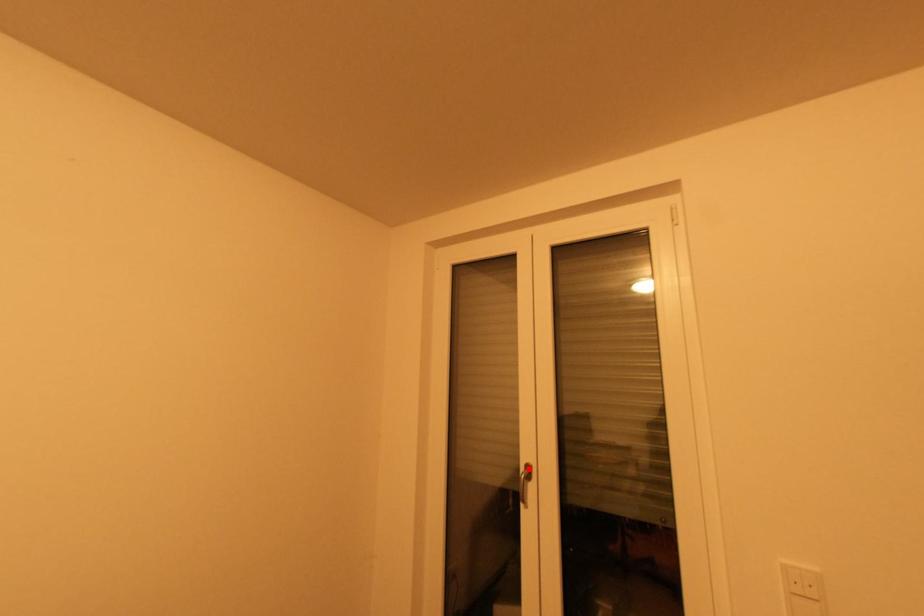
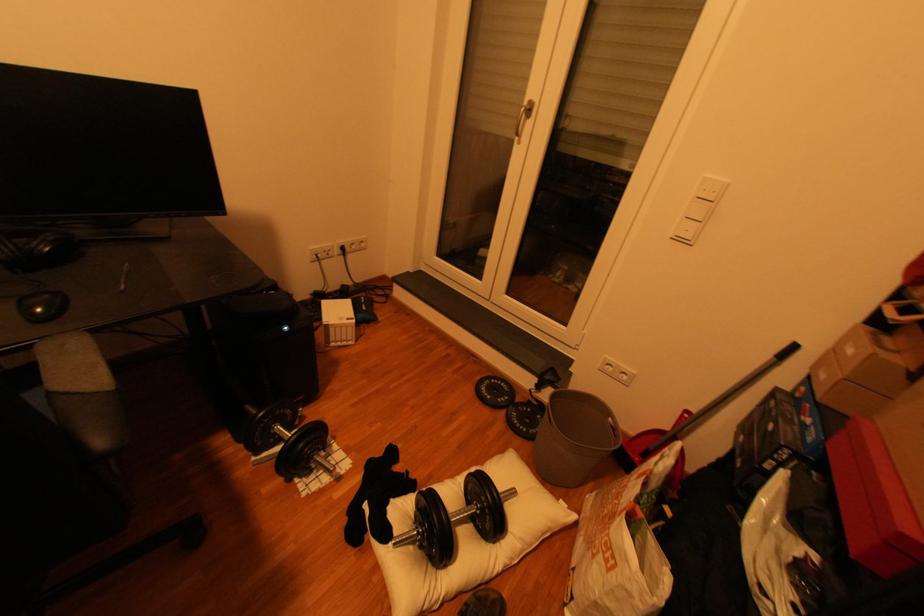
Question: I am providing you with two images of the same scene from different viewpoints. A red point is shown in image1. For the corresponding object point in image2, is it positioned nearer or farther from the camera?

Choices:
 (A) Nearer
 (B) Farther

Answer: (A)